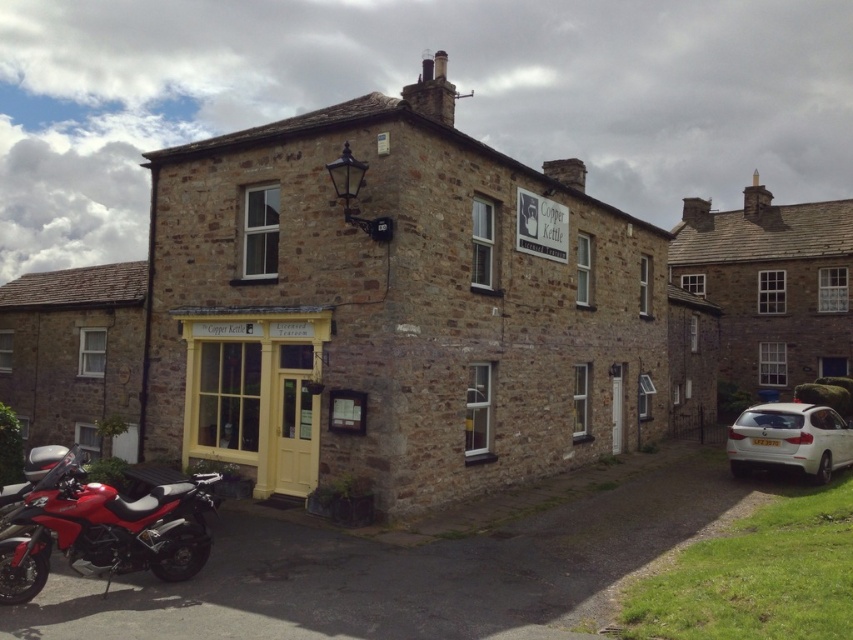
Describe the element at coordinates (105, 531) in the screenshot. I see `shiny red motorcycle at lower left` at that location.

Between point (207, 476) and point (769, 460), which one is positioned in front?

Point (207, 476) is more forward.

What are the coordinates of `shiny red motorcycle at lower left` in the screenshot? It's located at (105, 531).